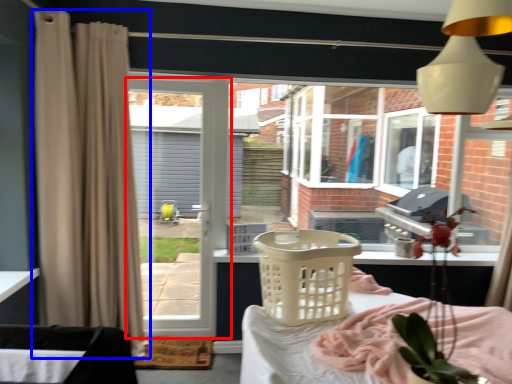
Question: Which point is further to the camera, door (highlighted by a red box) or curtain (highlighted by a blue box)?

Choices:
 (A) door
 (B) curtain

Answer: (A)